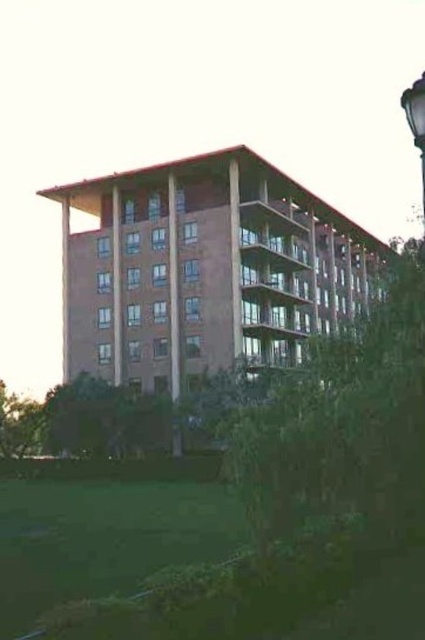
Question: Does brown brick building at center appear under black metal street light at upper right?

Choices:
 (A) yes
 (B) no

Answer: (A)

Question: Can you confirm if brown brick building at center is positioned above black metal street light at upper right?

Choices:
 (A) yes
 (B) no

Answer: (B)

Question: Among these points, which one is nearest to the camera?

Choices:
 (A) (274, 364)
 (B) (421, 170)

Answer: (A)

Question: Is the position of brown brick building at center more distant than that of black metal street light at upper right?

Choices:
 (A) no
 (B) yes

Answer: (B)

Question: Which of the following is the closest to the observer?

Choices:
 (A) brown brick building at center
 (B) black metal street light at upper right

Answer: (B)

Question: Among these points, which one is nearest to the camera?

Choices:
 (A) (x=265, y=339)
 (B) (x=422, y=177)

Answer: (A)